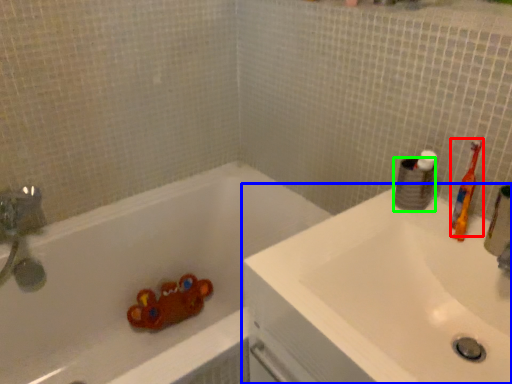
Question: Based on their relative distances, which object is nearer to toothbrush (highlighted by a red box)? Choose from sink (highlighted by a blue box) and toilet paper (highlighted by a green box).

Choices:
 (A) sink
 (B) toilet paper

Answer: (B)